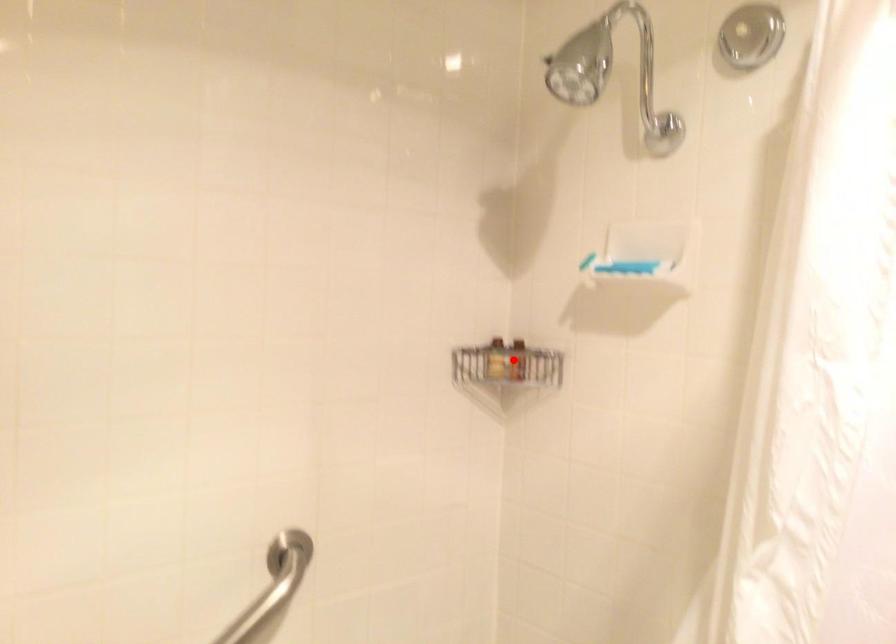
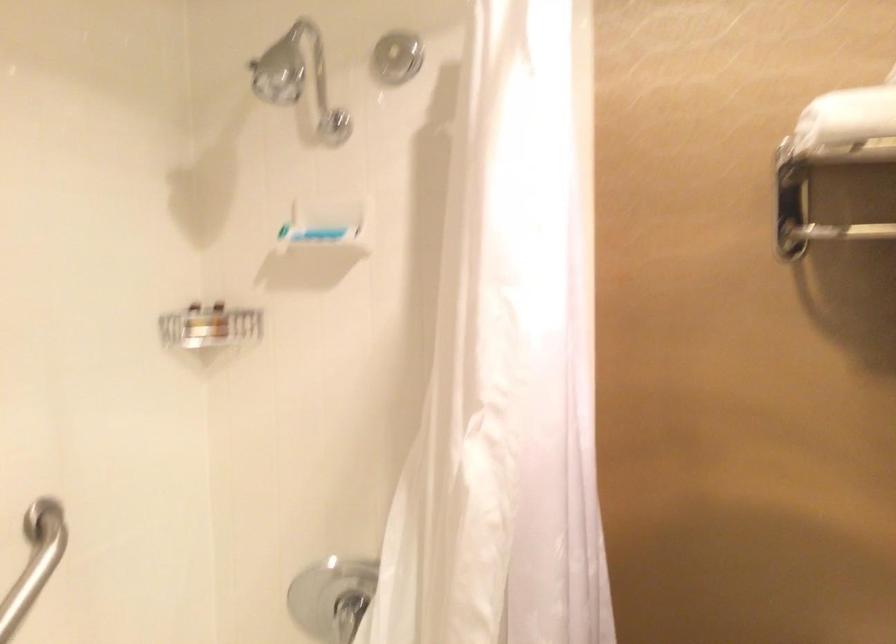
Question: A red point is marked in image1. In image2, is the corresponding 3D point closer to the camera or farther? Reply with the corresponding letter.

Choices:
 (A) The corresponding 3D point is closer.
 (B) The corresponding 3D point is farther.

Answer: (B)